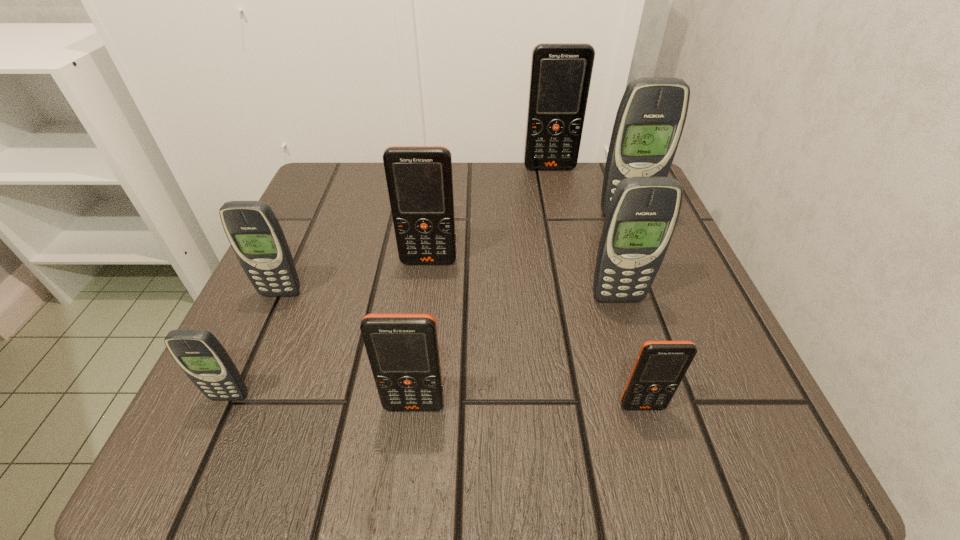
You are a GUI agent. You are given a task and a screenshot of the screen. Output one action in this format:
    pyautogui.click(x=<x>, y=<y>)
    Task: Click on the nearest gray cellular telephone
    
    Given the screenshot: What is the action you would take?
    [x=200, y=355]

Locate an element on the screen. vacant space situated on the screen of the biggest orange cellular telephone is located at coordinates (554, 188).

The height and width of the screenshot is (540, 960). What are the coordinates of `blank space located on the screen of the seventh nearest cellular telephone` in the screenshot? It's located at (640, 256).

I want to click on vacant region located on the screen of the sixth nearest cellular telephone, so click(411, 403).

Where is `vacant space located 0.080m on the screen of the third smallest gray cellular telephone`? The image size is (960, 540). vacant space located 0.080m on the screen of the third smallest gray cellular telephone is located at coordinates (631, 342).

Identify the location of vacant region located on the screen of the second smallest gray cellular telephone. (267, 325).

Identify the location of vacant region located 0.050m on the screen of the nearest gray cellular telephone. This screenshot has height=540, width=960. (211, 437).

Where is `object that is at the near right corner`? The image size is (960, 540). object that is at the near right corner is located at coordinates (660, 366).

At what (x,y) coordinates should I click in order to perform the action: click on free region at the far edge. Please return your answer as a coordinate pair (x, y). This screenshot has width=960, height=540. Looking at the image, I should click on (386, 206).

Locate an element on the screen. The image size is (960, 540). free space at the near edge is located at coordinates (382, 453).